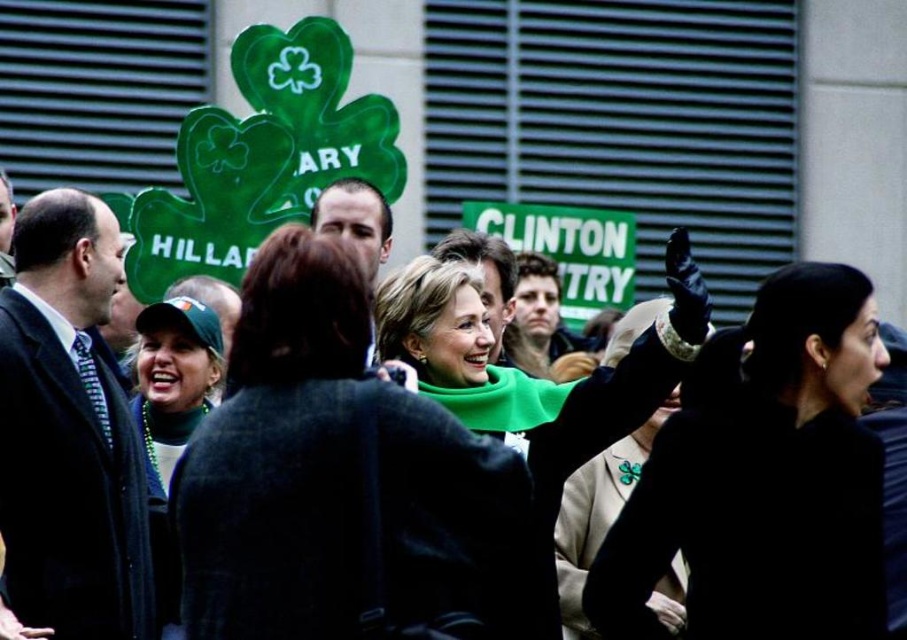
You are a photographer at the event and want to capture a clear shot of the woman in the green sweater. The green matte scarf at center and smooth brown hair at center are both visible in your frame. Which object is closer to the camera?

The green matte scarf at center is positioned under smooth brown hair at center, so the scarf is closer to the camera than the hair.